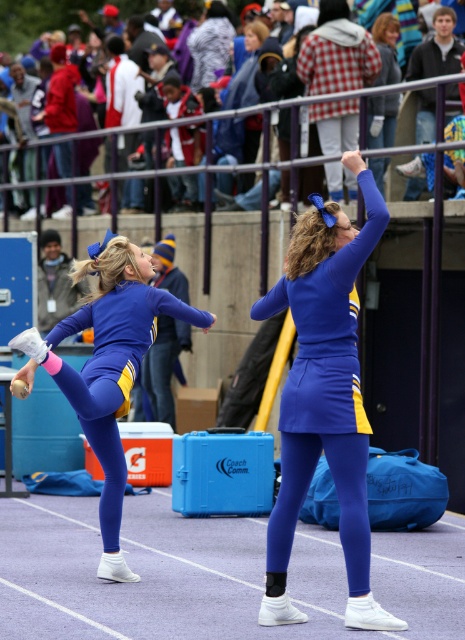
You are a photographer trying to capture the two cheerleaders in the scene. You notice the blue fabric cheerleader at center and the matte blue uniform at center. Which one is located to the right of the other?

The blue fabric cheerleader at center is positioned on the right side of matte blue uniform at center.

You are a photographer trying to capture the blue fabric cheerleader at center and the plaid fabric jacket at upper center in a single shot. Based on their sizes in the image, which one would you need to zoom in more on to ensure it fills the frame properly?

The blue fabric cheerleader at center occupies less space than the plaid fabric jacket at upper center, so you would need to zoom in more on the blue fabric cheerleader at center to ensure it fills the frame properly.

You are a photographer trying to capture the blue fabric cheerleader at center. If you move 0.1 units to the right and 0.1 units up from your current position at point 0.522, 0.599, will you be directly in front of the cheerleader?

The blue fabric cheerleader at center is located at point (325, 397). Moving 0.1 units right and up from (278, 333) brings you to (325, 397), so yes, you will be directly in front of the cheerleader.